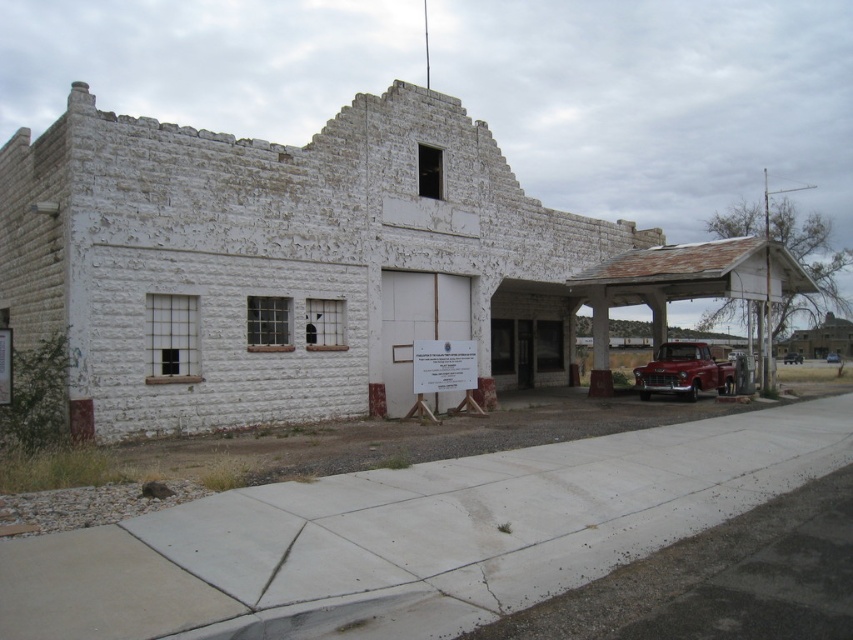
Based on the photo, you are a delivery driver who needs to park your metallic silver pickup truck at right and metallic silver truck at right in the parking lot next to the old weathered building. Since both vehicles are metallic silver, how can you distinguish which one is the pickup truck?

The metallic silver pickup truck at right is positioned on the left side of the metallic silver truck at right, so the one on the left is the pickup truck.

Based on the photo, you are a delivery person trying to park your metallic silver pickup truck at right and metallic silver truck at right in front of the old weathered building. Which one can fit into the parking space if the space is only large enough for the smaller vehicle?

The metallic silver pickup truck at right can fit into the parking space since it has a smaller size compared to the metallic silver truck at right.